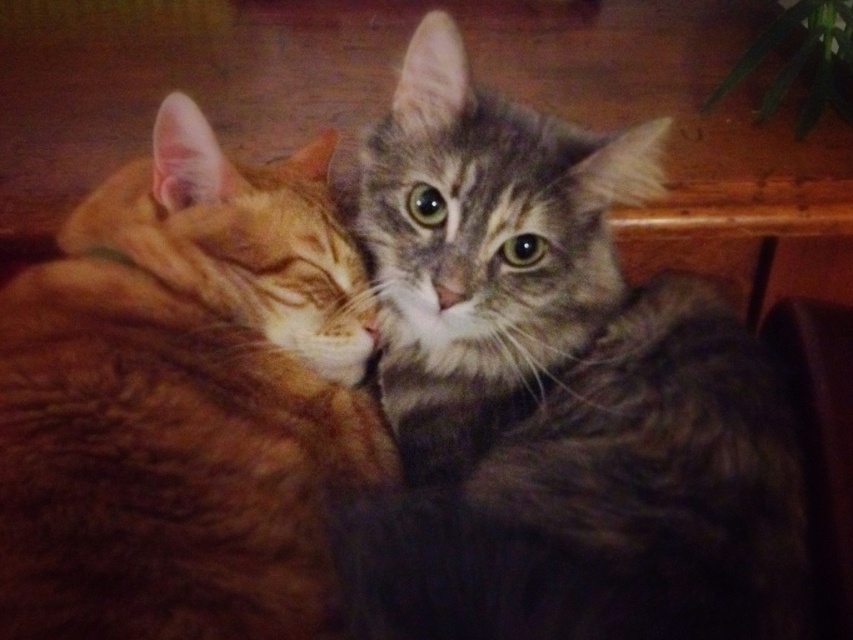
Question: Observing the image, what is the correct spatial positioning of tabby fur cat at center in reference to orange tabby cat at left?

Choices:
 (A) right
 (B) left

Answer: (A)

Question: Among these objects, which one is farthest from the camera?

Choices:
 (A) orange tabby cat at left
 (B) tabby fur cat at center

Answer: (B)

Question: Which point is closer to the camera taking this photo?

Choices:
 (A) (109, 188)
 (B) (398, 323)

Answer: (A)

Question: Observing the image, what is the correct spatial positioning of tabby fur cat at center in reference to orange tabby cat at left?

Choices:
 (A) right
 (B) left

Answer: (A)

Question: Does tabby fur cat at center have a lesser width compared to orange tabby cat at left?

Choices:
 (A) no
 (B) yes

Answer: (A)

Question: Which object appears farthest from the camera in this image?

Choices:
 (A) tabby fur cat at center
 (B) orange tabby cat at left

Answer: (A)